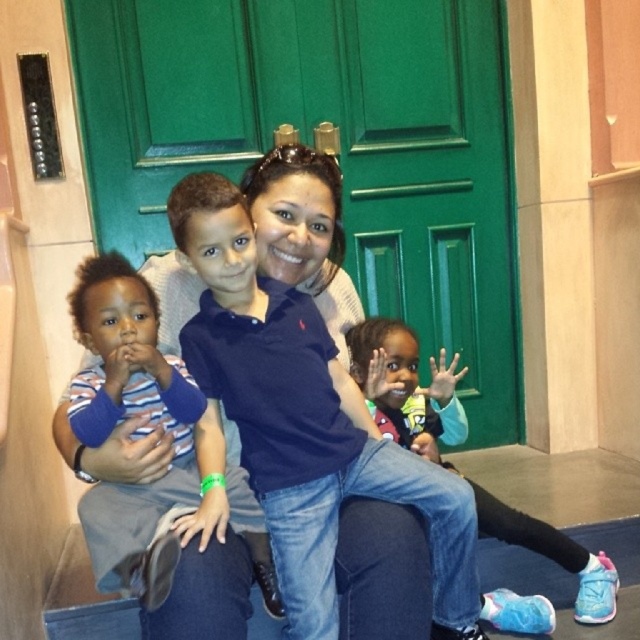
Is blue cotton shirt at center thinner than blue fabric pants at lower right?

In fact, blue cotton shirt at center might be wider than blue fabric pants at lower right.

Is the position of blue cotton shirt at center more distant than that of blue fabric pants at lower right?

No, blue cotton shirt at center is closer to the viewer.

Does point (307, 176) come in front of point (496, 589)?

Yes, point (307, 176) is in front of point (496, 589).

At what (x,y) coordinates should I click in order to perform the action: click on blue cotton shirt at center. Please return your answer as a coordinate pair (x, y). This screenshot has height=640, width=640. Looking at the image, I should click on (381, 572).

Which of these two, striped cotton shirt at left or blue fabric pants at lower right, stands shorter?

With less height is striped cotton shirt at left.

Does striped cotton shirt at left have a lesser width compared to blue fabric pants at lower right?

Correct, striped cotton shirt at left's width is less than blue fabric pants at lower right's.

Identify the location of striped cotton shirt at left. (129, 417).

Can you confirm if blue cotton shirt at center is positioned to the right of striped cotton shirt at left?

Yes, blue cotton shirt at center is to the right of striped cotton shirt at left.

The height and width of the screenshot is (640, 640). Identify the location of blue cotton shirt at center. (381, 572).

Where is `blue cotton shirt at center`? blue cotton shirt at center is located at coordinates (381, 572).